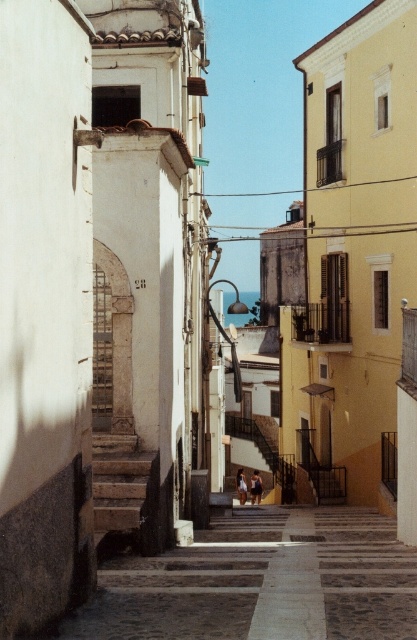
Question: Which point appears farthest from the camera in this image?

Choices:
 (A) (258, 502)
 (B) (243, 502)

Answer: (A)

Question: Which point is farther to the camera?

Choices:
 (A) (156, 497)
 (B) (253, 492)

Answer: (B)

Question: In this image, where is stone stairs at lower center located relative to light brown fabric pants at center?

Choices:
 (A) above
 (B) below

Answer: (A)

Question: Which object is positioned closest to the stone stairs at lower center?

Choices:
 (A) light brown fabric pants at center
 (B) tan fabric bikini at center

Answer: (B)

Question: Is stone stairs at lower center thinner than tan fabric bikini at center?

Choices:
 (A) yes
 (B) no

Answer: (B)

Question: Is light brown fabric pants at center to the right of tan fabric bikini at center from the viewer's perspective?

Choices:
 (A) yes
 (B) no

Answer: (A)